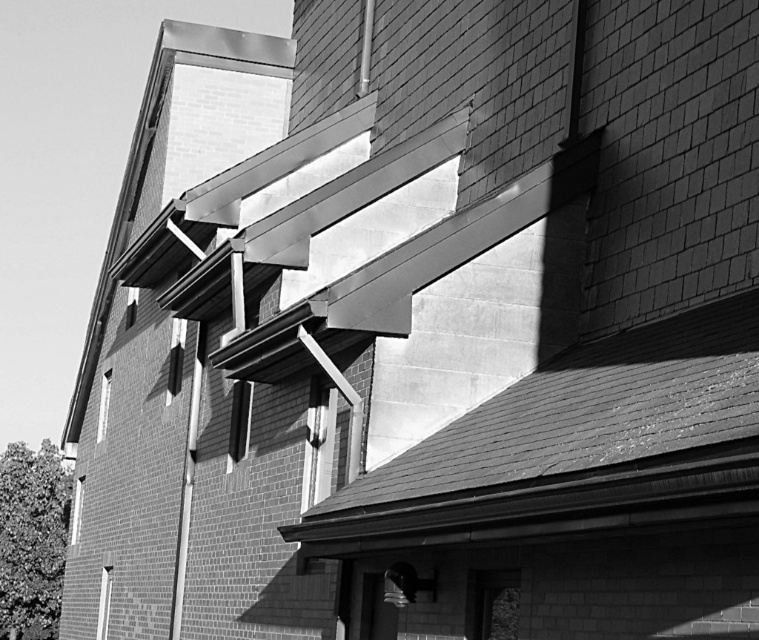
Question: Which point is farther to the camera?

Choices:
 (A) (320, 476)
 (B) (106, 376)
 (C) (465, 621)
 (D) (106, 611)

Answer: (B)

Question: Considering the relative positions of transparent glass window at lower center and clear glass window at upper left in the image provided, where is transparent glass window at lower center located with respect to clear glass window at upper left?

Choices:
 (A) right
 (B) left

Answer: (A)

Question: Which point is closer to the camera?

Choices:
 (A) (102, 568)
 (B) (334, 428)

Answer: (B)

Question: Is matte glass window at center above clear glass window at center?

Choices:
 (A) no
 (B) yes

Answer: (B)

Question: Among these objects, which one is farthest from the camera?

Choices:
 (A) clear glass window at lower left
 (B) clear glass window at center
 (C) clear glass window at upper left
 (D) matte glass window at center

Answer: (A)

Question: Does transparent glass window at lower center appear on the right side of clear glass window at upper left?

Choices:
 (A) yes
 (B) no

Answer: (A)